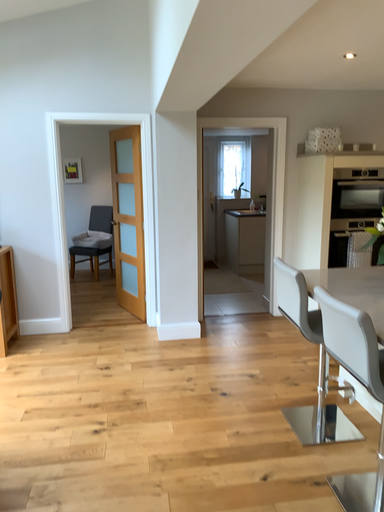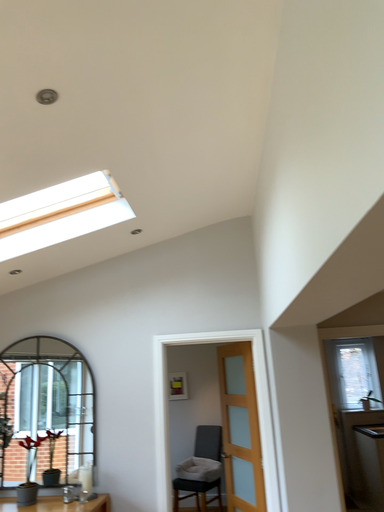
Question: Which way did the camera rotate in the video?

Choices:
 (A) rotated upward
 (B) rotated downward

Answer: (A)